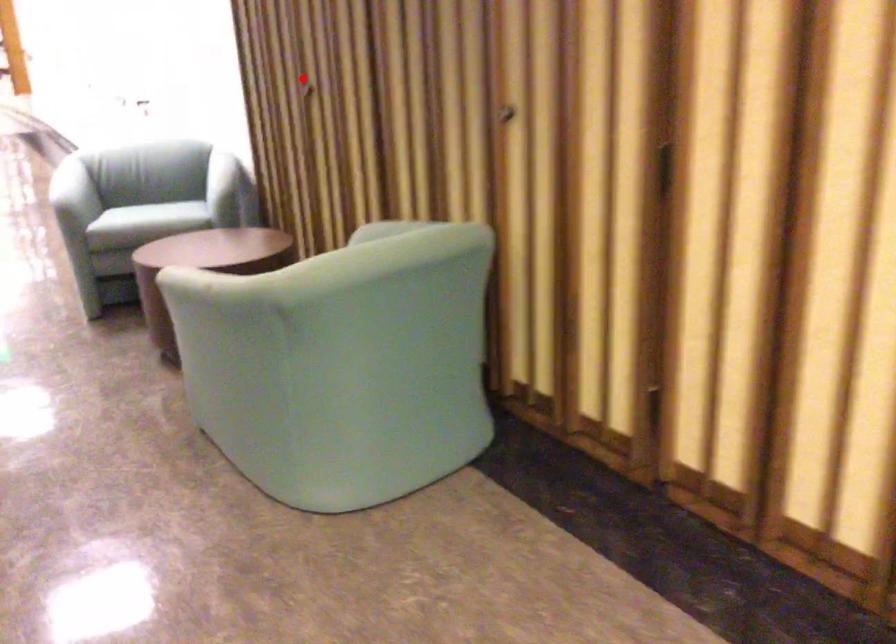
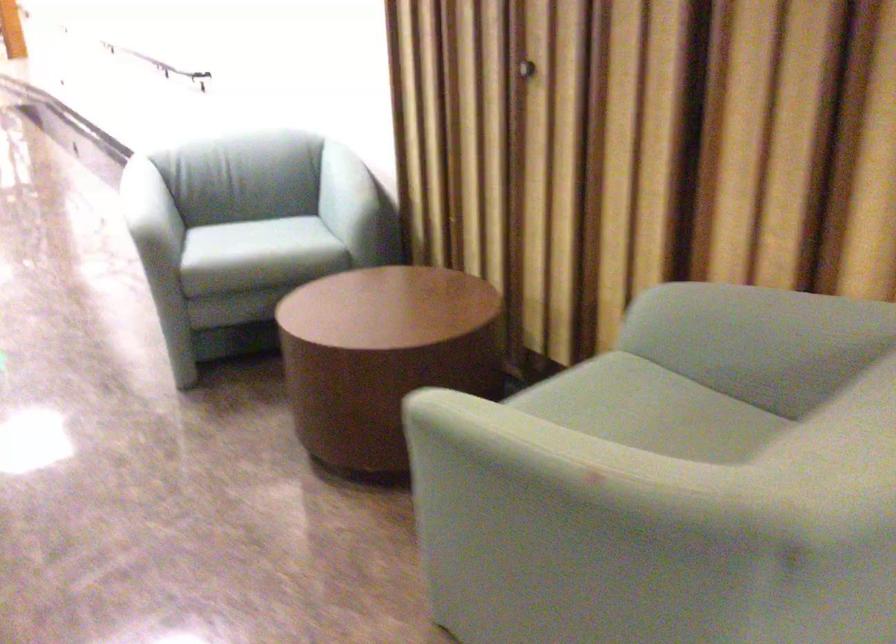
Find the pixel in the second image that matches the highlighted location in the first image.

(524, 70)